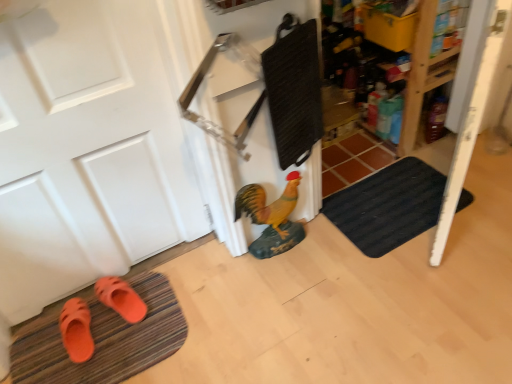
The height and width of the screenshot is (384, 512). Identify the location of vacant area that lies between shiny yellow chicken at center and orange rubber bath mat at lower left, which appears as the second bath mat when viewed from the top. (210, 284).